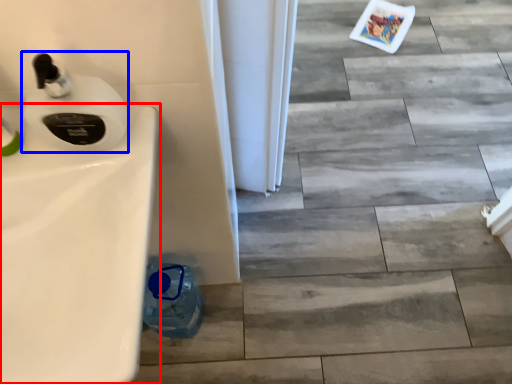
Question: Which point is further to the camera, sink (highlighted by a red box) or soap dispenser (highlighted by a blue box)?

Choices:
 (A) sink
 (B) soap dispenser

Answer: (B)